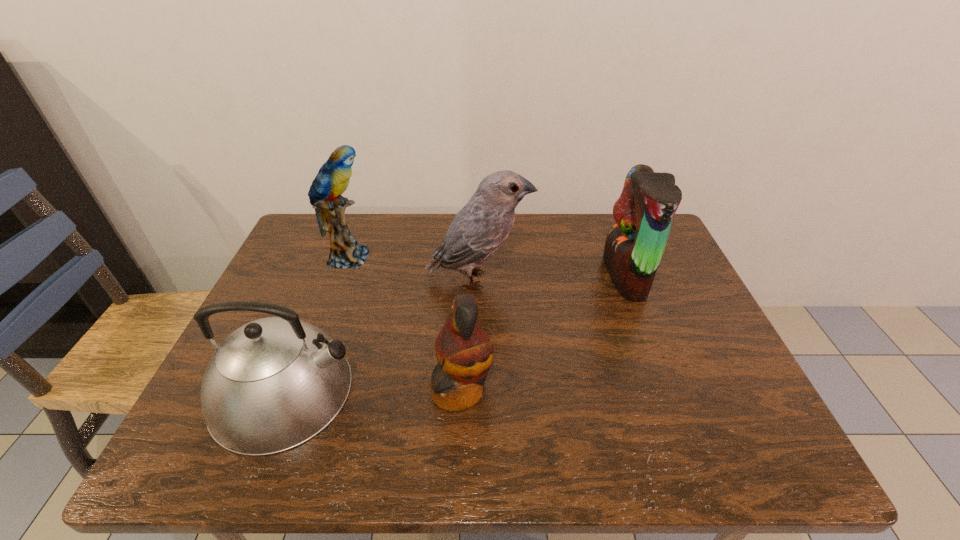
Find the location of `the leftmost parrot`. the leftmost parrot is located at coordinates (332, 180).

You are a GUI agent. You are given a task and a screenshot of the screen. Output one action in this format:
    pyautogui.click(x=<x>, y=<y>)
    Task: Click on the rightmost parrot
    The width and height of the screenshot is (960, 540).
    Given the screenshot: What is the action you would take?
    pyautogui.click(x=634, y=247)

Identify the location of the nearest parrot. This screenshot has height=540, width=960. (464, 351).

This screenshot has width=960, height=540. I want to click on kettle, so click(x=274, y=383).

Find the location of `free space located 0.180m on the face of the leftmost parrot`. free space located 0.180m on the face of the leftmost parrot is located at coordinates [437, 257].

Locate an element on the screen. vacant space located 0.060m at the face of the rightmost parrot is located at coordinates (586, 275).

Find the location of a particular element. This screenshot has height=540, width=960. vacant region located 0.260m at the face of the rightmost parrot is located at coordinates (516, 275).

Identify the location of vacant point located 0.400m at the face of the rightmost parrot. This screenshot has width=960, height=540. (466, 275).

Find the location of a particular element. The height and width of the screenshot is (540, 960). vacant region located 0.330m on the face of the nearest parrot is located at coordinates (643, 390).

Find the location of a particular element. The width and height of the screenshot is (960, 540). vacant space situated 0.130m from the spout of the kettle is located at coordinates (416, 391).